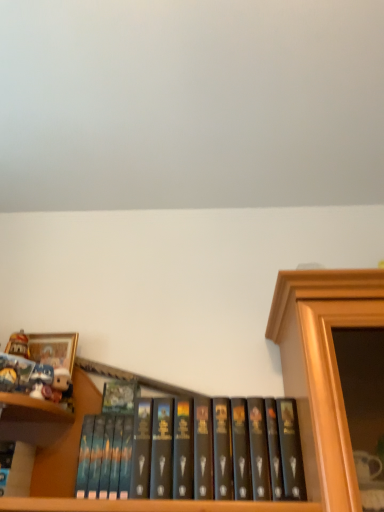
Question: Is black matte book at center, arranged as the 2th book when viewed from the left, at the right side of matte white plush toy at upper left?

Choices:
 (A) no
 (B) yes

Answer: (B)

Question: Can you confirm if black matte book at center, arranged as the 2th book when viewed from the left, is positioned to the left of matte white plush toy at upper left?

Choices:
 (A) no
 (B) yes

Answer: (A)

Question: Is black matte book at center, which ranks as the first book in right-to-left order, oriented away from matte white plush toy at upper left?

Choices:
 (A) no
 (B) yes

Answer: (A)

Question: Are black matte book at center, the 1th book from the bottom, and matte white plush toy at upper left located far from each other?

Choices:
 (A) no
 (B) yes

Answer: (A)

Question: Can we say black matte book at center, the 1th book from the bottom, lies outside matte white plush toy at upper left?

Choices:
 (A) no
 (B) yes

Answer: (B)

Question: Considering the relative sizes of black matte book at center, the 1th book from the bottom, and matte white plush toy at upper left in the image provided, is black matte book at center, the 1th book from the bottom, wider than matte white plush toy at upper left?

Choices:
 (A) yes
 (B) no

Answer: (A)

Question: Can you confirm if hardcover book at left, placed as the 1th book when sorted from left to right, is wider than matte white plush toy at upper left?

Choices:
 (A) no
 (B) yes

Answer: (A)

Question: Can you confirm if hardcover book at left, marked as the 1th book in a top-to-bottom arrangement, is positioned to the left of matte white plush toy at upper left?

Choices:
 (A) no
 (B) yes

Answer: (B)

Question: Is hardcover book at left, placed as the 2th book when sorted from bottom to top, further to camera compared to matte white plush toy at upper left?

Choices:
 (A) no
 (B) yes

Answer: (A)

Question: Does hardcover book at left, which is counted as the second book, starting from the right, have a greater height compared to matte white plush toy at upper left?

Choices:
 (A) yes
 (B) no

Answer: (A)

Question: Can you confirm if hardcover book at left, which is counted as the second book, starting from the right, is thinner than matte white plush toy at upper left?

Choices:
 (A) yes
 (B) no

Answer: (A)

Question: Is hardcover book at left, placed as the 1th book when sorted from left to right, not inside matte white plush toy at upper left?

Choices:
 (A) no
 (B) yes

Answer: (B)

Question: Considering the relative positions of gold-framed picture at upper left and matte white plush toy at upper left in the image provided, is gold-framed picture at upper left to the right of matte white plush toy at upper left from the viewer's perspective?

Choices:
 (A) no
 (B) yes

Answer: (A)